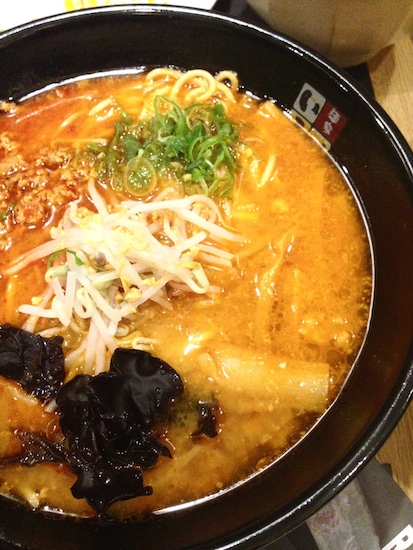
You are a GUI agent. You are given a task and a screenshot of the screen. Output one action in this format:
    pyautogui.click(x=<x>, y=<y>)
    Task: Click on the wood table
    The width and height of the screenshot is (413, 550).
    Given the screenshot: What is the action you would take?
    pyautogui.click(x=408, y=423), pyautogui.click(x=406, y=453), pyautogui.click(x=402, y=72)